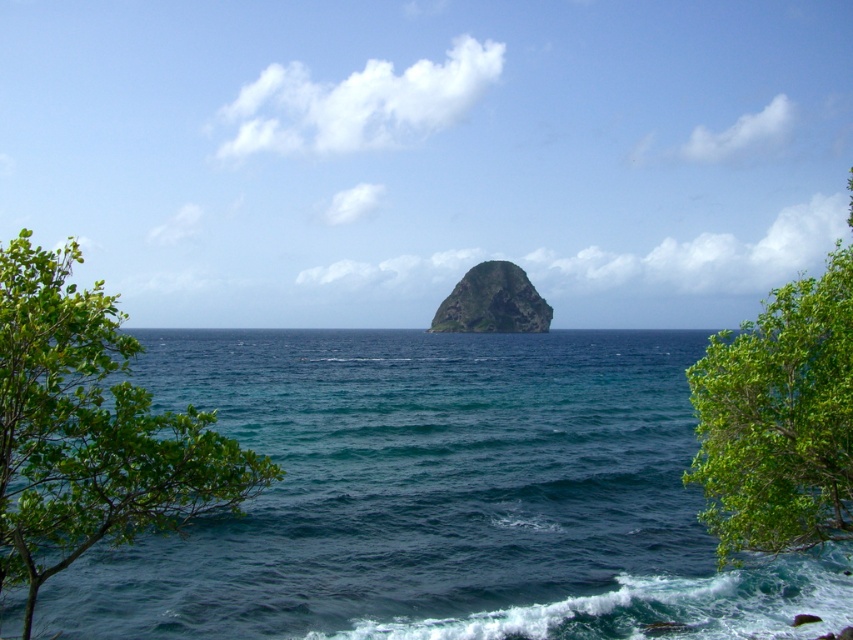
Can you confirm if deep blue water at center is taller than green rough rock at center?

No.

Can you confirm if deep blue water at center is wider than green rough rock at center?

Correct, the width of deep blue water at center exceeds that of green rough rock at center.

Image resolution: width=853 pixels, height=640 pixels. Identify the location of deep blue water at center. (442, 497).

Locate an element on the screen. The height and width of the screenshot is (640, 853). deep blue water at center is located at coordinates (442, 497).

The width and height of the screenshot is (853, 640). What are the coordinates of `green leafy tree at left` in the screenshot? It's located at (90, 429).

Is green leafy tree at left shorter than green leafy tree at lower right?

No, green leafy tree at left is not shorter than green leafy tree at lower right.

Does point (44, 298) come in front of point (798, 282)?

Yes, point (44, 298) is in front of point (798, 282).

The image size is (853, 640). I want to click on green leafy tree at left, so click(x=90, y=429).

Does green leafy tree at left appear on the left side of green rough rock at center?

Correct, you'll find green leafy tree at left to the left of green rough rock at center.

Where is `green leafy tree at left`? The width and height of the screenshot is (853, 640). green leafy tree at left is located at coordinates (90, 429).